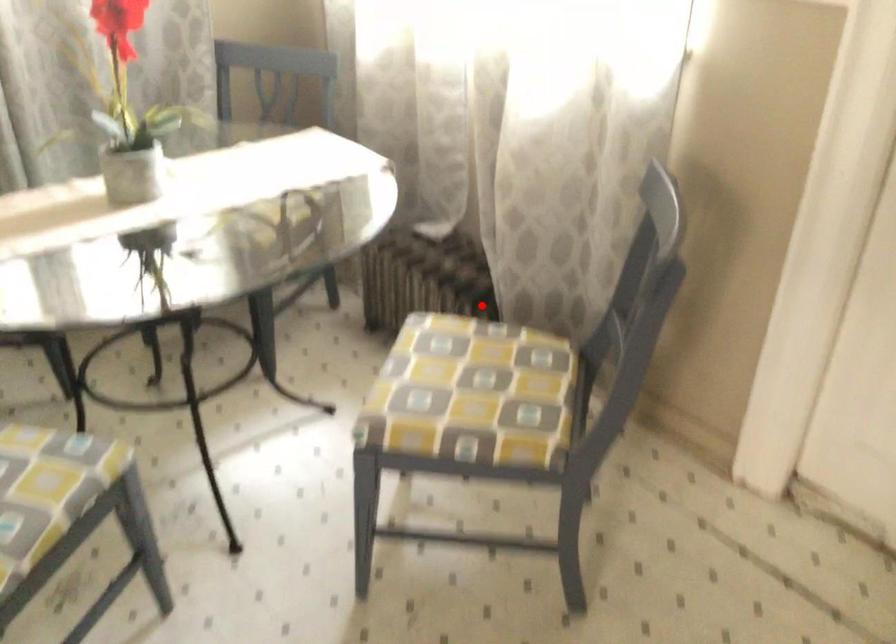
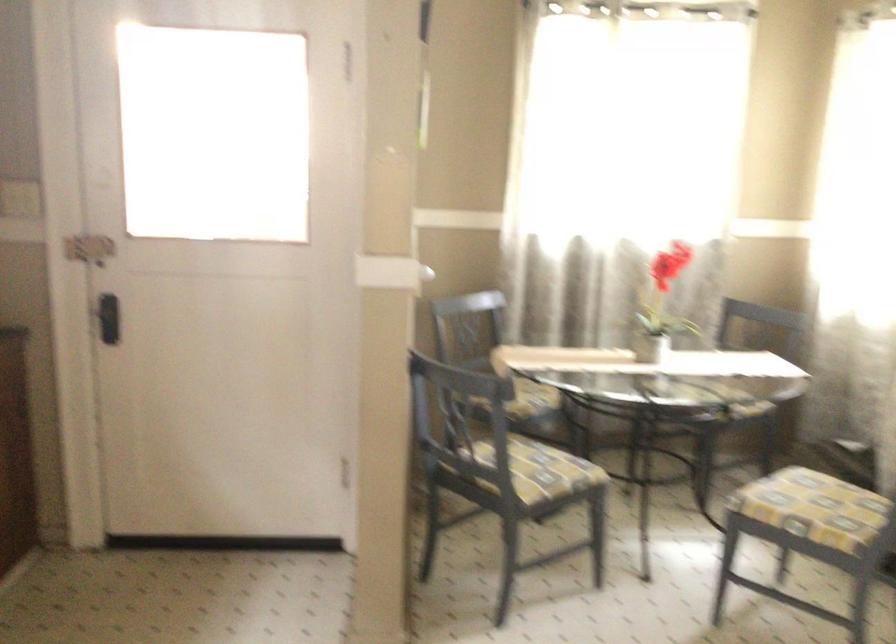
Locate, in the second image, the point that corresponds to the highlighted location in the first image.

(833, 460)